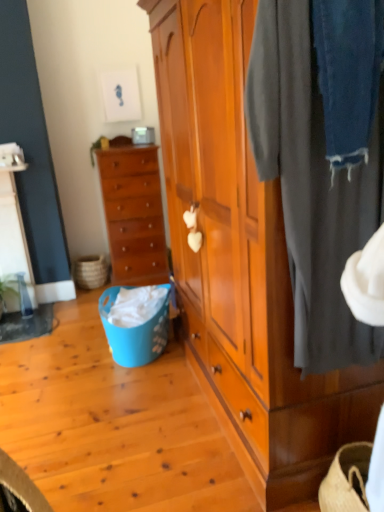
Question: Is dark gray fabric at right surrounding wooden chest of drawers at center left?

Choices:
 (A) yes
 (B) no

Answer: (B)

Question: Is dark gray fabric at right not inside wooden chest of drawers at center left?

Choices:
 (A) no
 (B) yes

Answer: (B)

Question: Is dark gray fabric at right aimed at wooden chest of drawers at center left?

Choices:
 (A) no
 (B) yes

Answer: (A)

Question: From the image's perspective, would you say dark gray fabric at right is positioned over wooden chest of drawers at center left?

Choices:
 (A) yes
 (B) no

Answer: (B)

Question: Does dark gray fabric at right have a lesser height compared to wooden chest of drawers at center left?

Choices:
 (A) yes
 (B) no

Answer: (A)

Question: Considering the positions of wooden wardrobe at center and natural woven picnic basket at lower left, the first picnic basket from the left, in the image, is wooden wardrobe at center wider or thinner than natural woven picnic basket at lower left, the first picnic basket from the left,?

Choices:
 (A) wide
 (B) thin

Answer: (A)

Question: Considering the positions of point (168, 60) and point (97, 275), is point (168, 60) closer or farther from the camera than point (97, 275)?

Choices:
 (A) farther
 (B) closer

Answer: (B)

Question: From the image's perspective, is wooden wardrobe at center positioned above or below natural woven picnic basket at lower left, the first picnic basket from the left?

Choices:
 (A) below
 (B) above

Answer: (B)

Question: From a real-world perspective, is wooden wardrobe at center above or below natural woven picnic basket at lower left, the first picnic basket from the left?

Choices:
 (A) above
 (B) below

Answer: (A)

Question: From the image's perspective, is blue plastic picnic basket at lower left, the 1th picnic basket viewed from the front, above or below wooden wardrobe at center?

Choices:
 (A) above
 (B) below

Answer: (B)

Question: Is blue plastic picnic basket at lower left, which ranks as the 2th picnic basket in left-to-right order, spatially inside wooden wardrobe at center, or outside of it?

Choices:
 (A) inside
 (B) outside

Answer: (B)

Question: Visually, is blue plastic picnic basket at lower left, which appears as the first picnic basket when viewed from the right, positioned to the left or to the right of wooden wardrobe at center?

Choices:
 (A) left
 (B) right

Answer: (A)

Question: Relative to wooden wardrobe at center, is blue plastic picnic basket at lower left, the 1th picnic basket viewed from the front, in front or behind?

Choices:
 (A) front
 (B) behind

Answer: (B)

Question: Considering the positions of wooden chest of drawers at center left and dark gray fabric at right in the image, is wooden chest of drawers at center left wider or thinner than dark gray fabric at right?

Choices:
 (A) thin
 (B) wide

Answer: (B)

Question: In the image, is wooden chest of drawers at center left on the left side or the right side of dark gray fabric at right?

Choices:
 (A) right
 (B) left

Answer: (B)